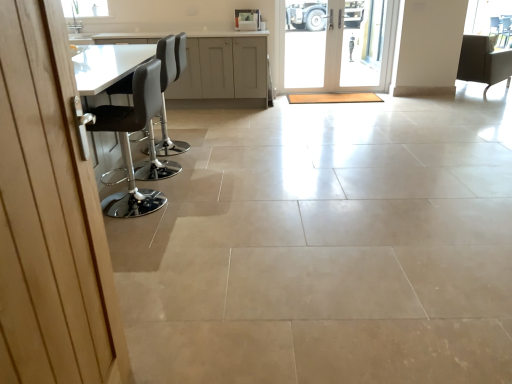
This screenshot has width=512, height=384. Identify the location of vacant area that is situated to the right of white leather bar stool at left, which appears as the second chair when viewed from the back. (209, 146).